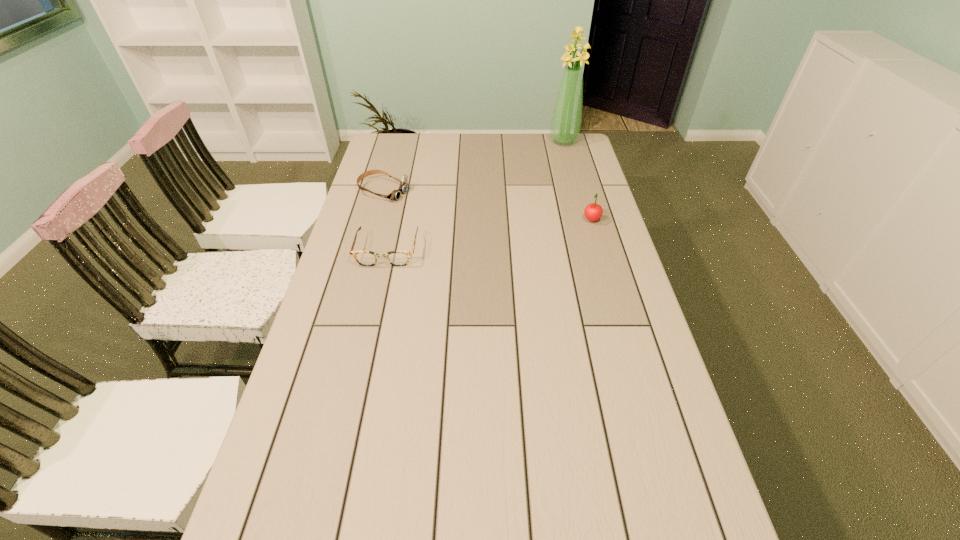
You are a GUI agent. You are given a task and a screenshot of the screen. Output one action in this format:
    pyautogui.click(x=<x>, y=<y>)
    Task: Click on the spectacles
    Image resolution: width=960 pixels, height=540 pixels.
    Given the screenshot: What is the action you would take?
    pos(365,258)

Locate an element on the screen. The image size is (960, 540). the third farthest object is located at coordinates (593, 212).

Where is `the second tallest object`? This screenshot has width=960, height=540. the second tallest object is located at coordinates (593, 212).

Image resolution: width=960 pixels, height=540 pixels. Identify the location of the second farthest object. coord(395,194).

Where is `the farthest object`? This screenshot has width=960, height=540. the farthest object is located at coordinates (566, 119).

Image resolution: width=960 pixels, height=540 pixels. In order to click on the tallest object in this screenshot , I will do `click(566, 119)`.

I want to click on free space located 0.380m on the frame of the spectacles, so click(360, 374).

What are the coordinates of `vacant area located on the front of the second tallest object` in the screenshot? It's located at (606, 267).

Locate an element on the screen. Image resolution: width=960 pixels, height=540 pixels. free space located 0.350m on the front-facing side of the second farthest object is located at coordinates (492, 221).

Locate an element on the screen. vacant area situated 0.290m on the front-facing side of the second farthest object is located at coordinates (477, 217).